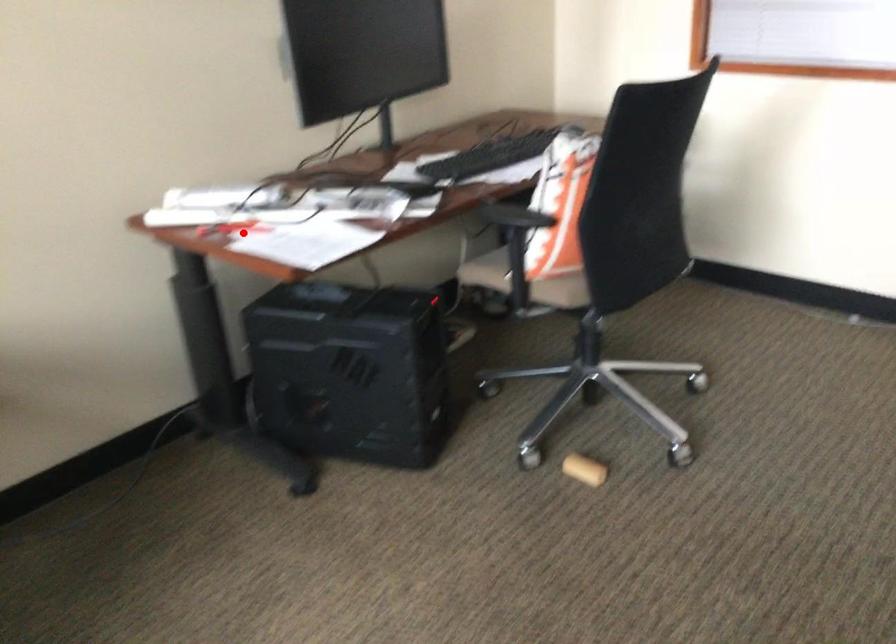
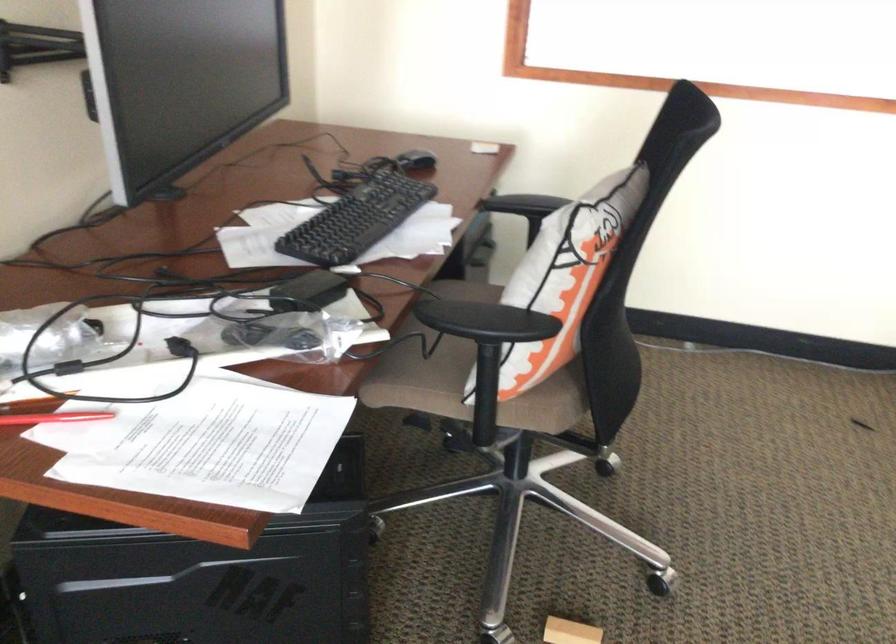
Question: I am providing you with two images of the same scene from different viewpoints. Given a red point in image1, look at the same physical point in image2. Is it:

Choices:
 (A) Closer to the viewpoint
 (B) Farther from the viewpoint

Answer: (A)